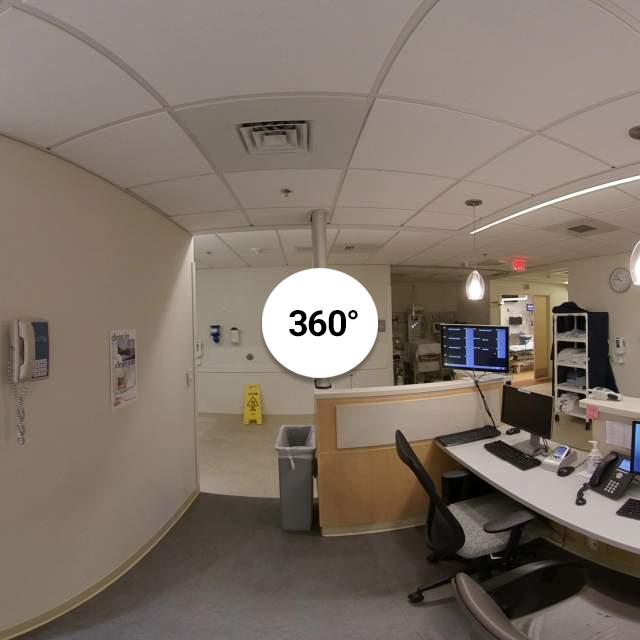
The width and height of the screenshot is (640, 640). In order to click on trash can in this screenshot , I will do `click(292, 481)`.